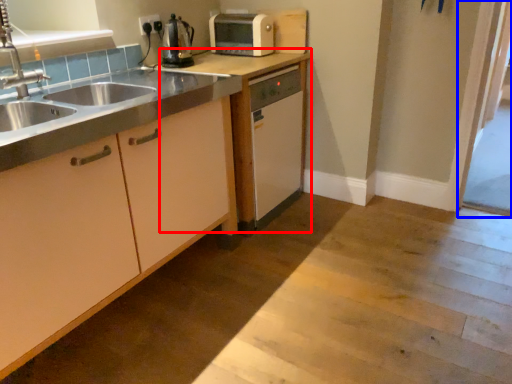
Question: Which point is closer to the camera, cabinetry (highlighted by a red box) or screen door (highlighted by a blue box)?

Choices:
 (A) cabinetry
 (B) screen door

Answer: (A)